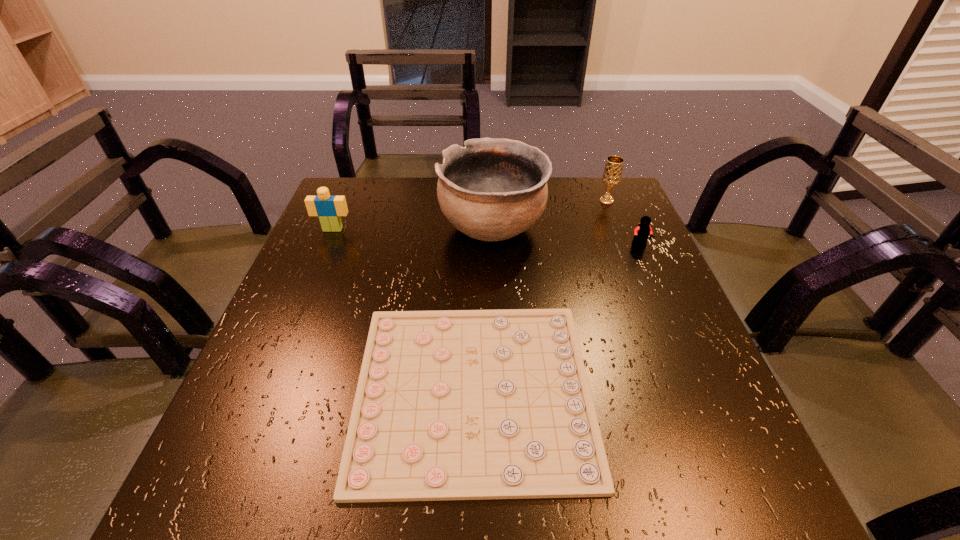
Identify the location of vacant space in between the nearest object and the chalice. Image resolution: width=960 pixels, height=540 pixels. (540, 295).

Find the location of `empty space between the nearest object and the chalice`. empty space between the nearest object and the chalice is located at coordinates (540, 295).

Image resolution: width=960 pixels, height=540 pixels. I want to click on free spot between the tallest object and the chalice, so click(549, 214).

You are a GUI agent. You are given a task and a screenshot of the screen. Output one action in this format:
    pyautogui.click(x=<x>, y=<y>)
    Task: Click on the unoccupied position between the farther Lego and the tallest object
    The image size is (960, 540).
    Given the screenshot: What is the action you would take?
    pyautogui.click(x=413, y=228)

Identify which object is the third nearest to the taller Lego. Please provide its 2D coordinates. Your answer should be formatted as a tuple, i.e. [(x, y)], where the tuple contains the x and y coordinates of a point satisfying the conditions above.

[(612, 173)]

Image resolution: width=960 pixels, height=540 pixels. Find the location of `object that is the third closest one to the shorter Lego`. object that is the third closest one to the shorter Lego is located at coordinates (457, 404).

This screenshot has width=960, height=540. I want to click on free space that satisfies the following two spatial constraints: 1. on the face of the left Lego; 2. on the right side of the gameboard, so point(265,390).

Locate an element on the screen. This screenshot has width=960, height=540. vacant area that satisfies the following two spatial constraints: 1. on the face of the nearest object; 2. on the left side of the farther Lego is located at coordinates (265, 390).

Find the location of a particular element. This screenshot has width=960, height=540. vacant region that satisfies the following two spatial constraints: 1. on the back side of the nearest object; 2. on the left side of the chalice is located at coordinates (476, 201).

This screenshot has width=960, height=540. I want to click on vacant space that satisfies the following two spatial constraints: 1. on the face of the shortest object; 2. on the right side of the leftmost object, so click(265, 390).